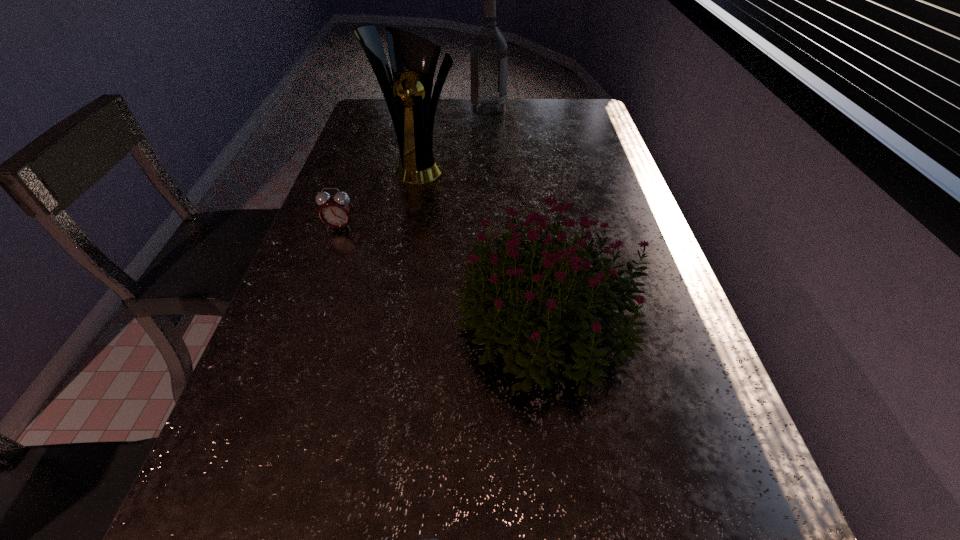
Find the location of a particular element. Image resolution: width=960 pixels, height=540 pixels. vacant area between the second farthest object and the leftmost object is located at coordinates (379, 197).

Locate an element on the screen. The height and width of the screenshot is (540, 960). free spot between the alarm clock and the award is located at coordinates pos(379,197).

This screenshot has height=540, width=960. In order to click on vacant space that's between the award and the alarm clock in this screenshot , I will do `click(379, 197)`.

Find the location of a particular element. This screenshot has width=960, height=540. vacant point located between the second nearest object and the liquor is located at coordinates (519, 216).

Image resolution: width=960 pixels, height=540 pixels. I want to click on object that is the second closest one to the award, so click(x=488, y=48).

Where is `object that is the second closest to the farthest object`? This screenshot has width=960, height=540. object that is the second closest to the farthest object is located at coordinates (336, 210).

This screenshot has width=960, height=540. What are the coordinates of `free space that satisfies the following two spatial constraints: 1. on the front-facing side of the farthest object; 2. at the front of the award, where the globe is visible` in the screenshot? It's located at (490, 167).

Find the location of a particular element. This screenshot has width=960, height=540. vacant space that satisfies the following two spatial constraints: 1. at the front of the third tallest object, where the globe is visible; 2. on the left side of the award is located at coordinates (390, 323).

Where is `free spot that satisfies the following two spatial constraints: 1. on the front-facing side of the second nearest object; 2. on the left side of the liquor`? The height and width of the screenshot is (540, 960). free spot that satisfies the following two spatial constraints: 1. on the front-facing side of the second nearest object; 2. on the left side of the liquor is located at coordinates (494, 323).

Identify the location of free location that satisfies the following two spatial constraints: 1. at the front of the second farthest object, where the globe is visible; 2. on the left side of the bouquet. The image size is (960, 540). pyautogui.click(x=390, y=323).